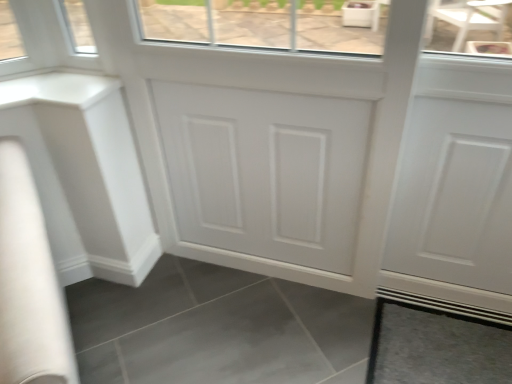
Question: Does white matte counter top at left have a lesser height compared to gray matte tile at lower right?

Choices:
 (A) no
 (B) yes

Answer: (A)

Question: Does white matte counter top at left appear on the right side of gray matte tile at lower right?

Choices:
 (A) no
 (B) yes

Answer: (A)

Question: Is white matte counter top at left positioned beyond the bounds of gray matte tile at lower right?

Choices:
 (A) yes
 (B) no

Answer: (A)

Question: Can you confirm if white matte counter top at left is smaller than gray matte tile at lower right?

Choices:
 (A) no
 (B) yes

Answer: (A)

Question: Is white matte counter top at left not near gray matte tile at lower right?

Choices:
 (A) no
 (B) yes

Answer: (B)

Question: Is the depth of white matte counter top at left greater than that of gray matte tile at lower right?

Choices:
 (A) no
 (B) yes

Answer: (A)

Question: Is gray matte tile at lower right not close to white matte counter top at left?

Choices:
 (A) no
 (B) yes

Answer: (B)

Question: Would you say gray matte tile at lower right is outside white matte counter top at left?

Choices:
 (A) yes
 (B) no

Answer: (A)

Question: Can you confirm if gray matte tile at lower right is thinner than white matte counter top at left?

Choices:
 (A) no
 (B) yes

Answer: (A)

Question: Considering the relative sizes of gray matte tile at lower right and white matte counter top at left in the image provided, is gray matte tile at lower right wider than white matte counter top at left?

Choices:
 (A) yes
 (B) no

Answer: (A)

Question: Considering the relative sizes of gray matte tile at lower right and white matte counter top at left in the image provided, is gray matte tile at lower right taller than white matte counter top at left?

Choices:
 (A) no
 (B) yes

Answer: (A)

Question: Does gray matte tile at lower right have a larger size compared to white matte counter top at left?

Choices:
 (A) no
 (B) yes

Answer: (A)

Question: In the image, is white matte counter top at left on the left side or the right side of gray matte tile at lower right?

Choices:
 (A) left
 (B) right

Answer: (A)